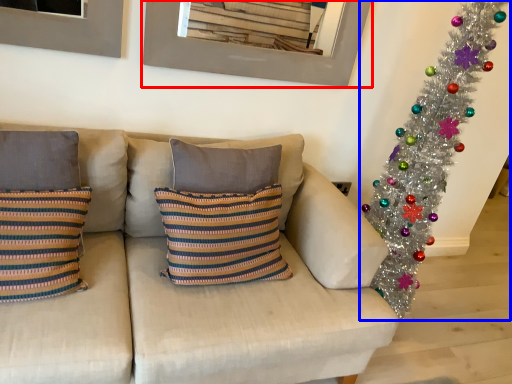
Question: Which object is closer to the camera taking this photo, picture frame (highlighted by a red box) or christmas tree (highlighted by a blue box)?

Choices:
 (A) picture frame
 (B) christmas tree

Answer: (B)